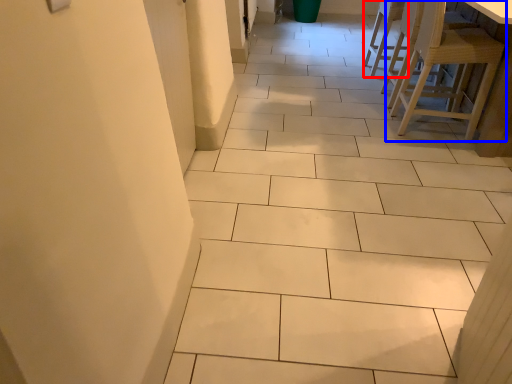
Question: Which point is closer to the camera, chair (highlighted by a red box) or chair (highlighted by a blue box)?

Choices:
 (A) chair
 (B) chair

Answer: (B)